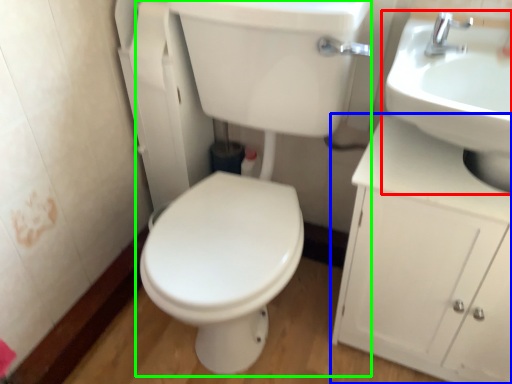
Question: Estimate the real-world distances between objects in this image. Which object is farther from sink (highlighted by a red box), bathroom cabinet (highlighted by a blue box) or porcelain (highlighted by a green box)?

Choices:
 (A) bathroom cabinet
 (B) porcelain

Answer: (B)